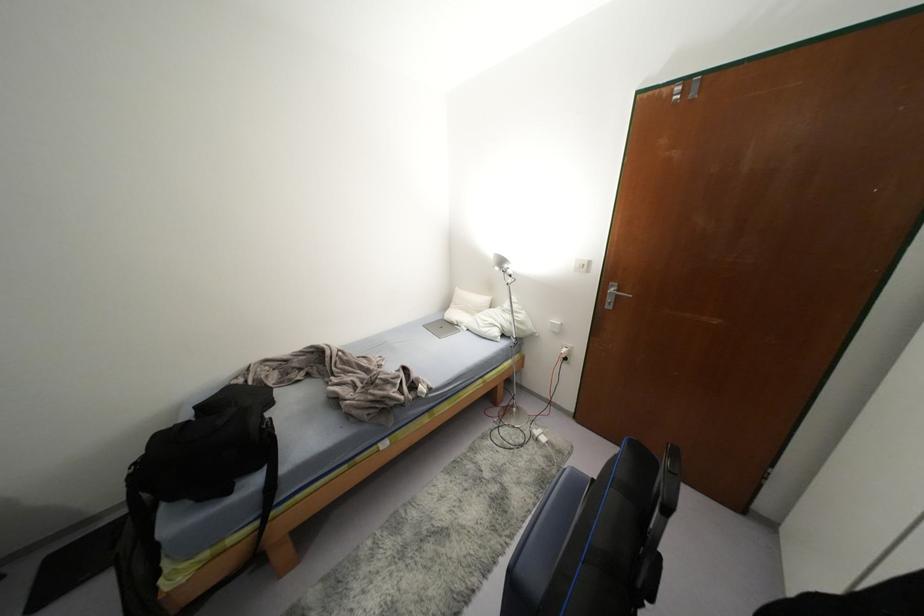
I want to click on silver lamp head, so click(500, 262).